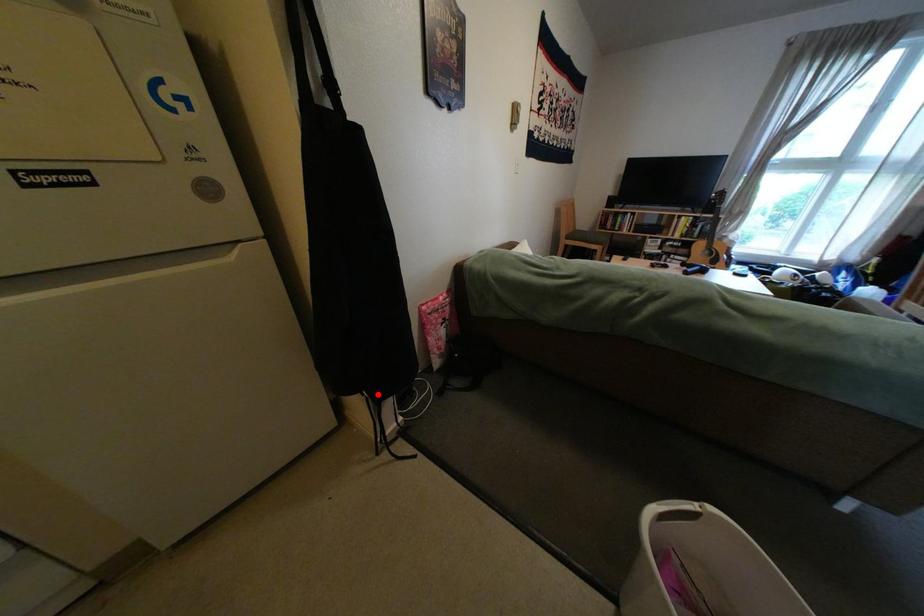
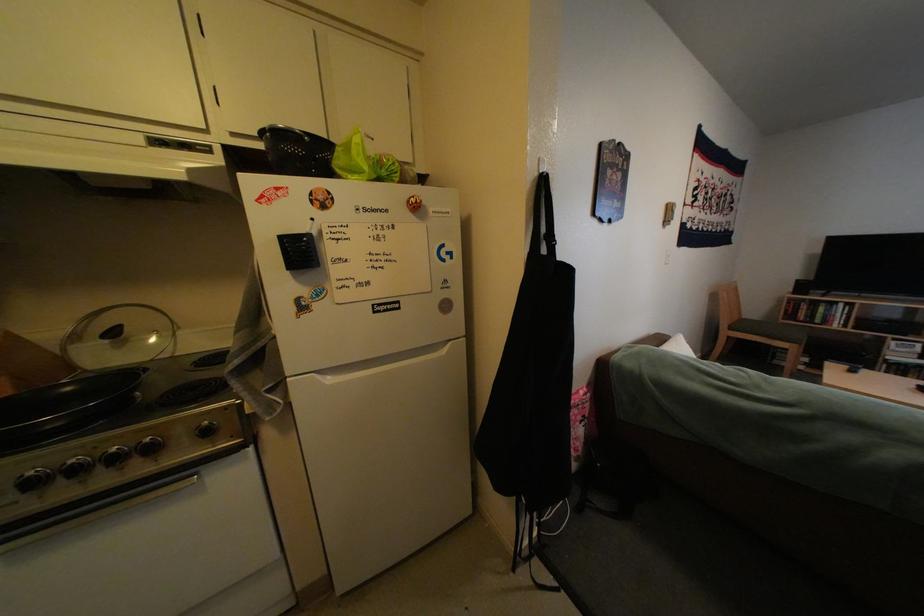
Find the pixel in the second image that matches the highlighted location in the first image.

(538, 499)